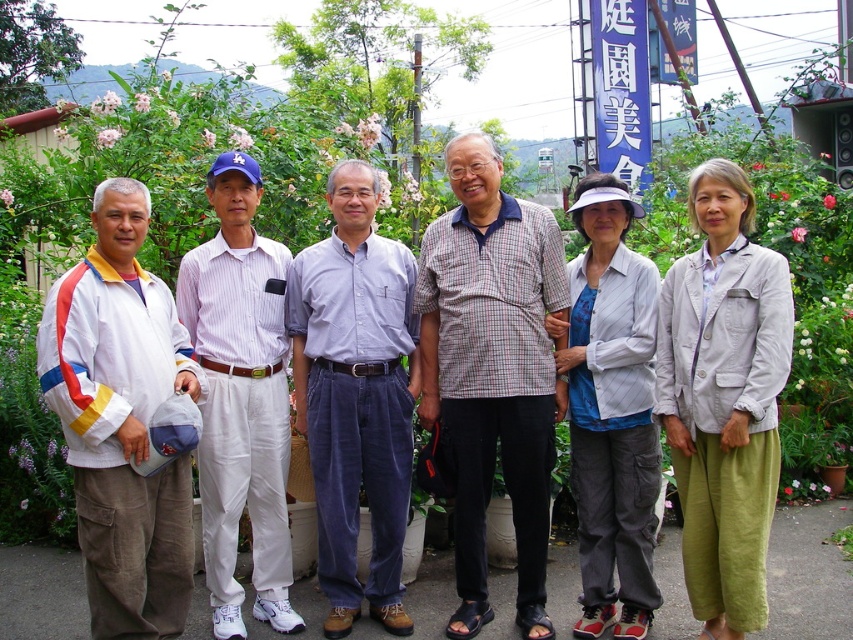
Question: Which of these objects is positioned closest to the white cotton jacket at left?

Choices:
 (A) gray striped pants at center
 (B) light gray cotton jacket at center right
 (C) light blue corduroy shirt at center
 (D) plaid cotton shirt at center

Answer: (C)

Question: Can you confirm if light blue corduroy shirt at center is wider than gray striped pants at center?

Choices:
 (A) yes
 (B) no

Answer: (A)

Question: Can you confirm if plaid cotton shirt at center is thinner than light blue corduroy shirt at center?

Choices:
 (A) yes
 (B) no

Answer: (B)

Question: Which point is closer to the camera?

Choices:
 (A) (352, 484)
 (B) (107, 237)

Answer: (B)

Question: Does white cotton jacket at left have a lesser width compared to light gray cotton jacket at center right?

Choices:
 (A) no
 (B) yes

Answer: (A)

Question: Which object appears farthest from the camera in this image?

Choices:
 (A) white striped shirt at center
 (B) light blue corduroy shirt at center
 (C) light gray cotton jacket at center right
 (D) white cotton jacket at left

Answer: (B)